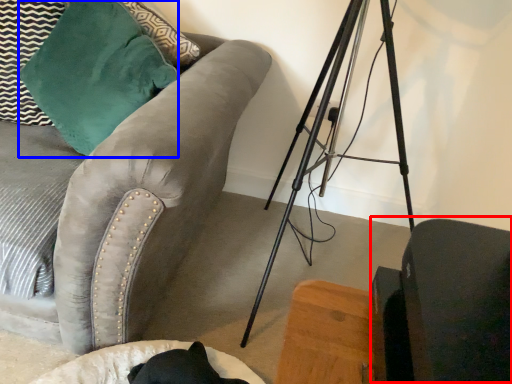
Question: Among these objects, which one is nearest to the camera, swivel chair (highlighted by a red box) or throw pillow (highlighted by a blue box)?

Choices:
 (A) swivel chair
 (B) throw pillow

Answer: (A)